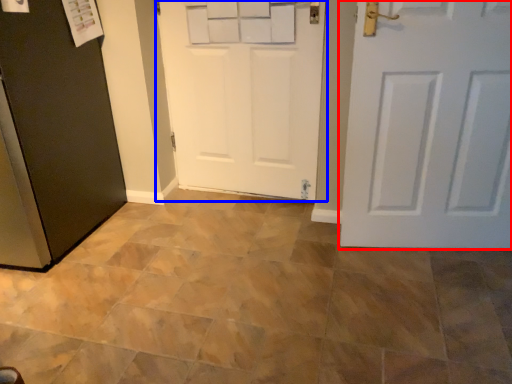
Question: Which object is closer to the camera taking this photo, door (highlighted by a red box) or door (highlighted by a blue box)?

Choices:
 (A) door
 (B) door

Answer: (A)